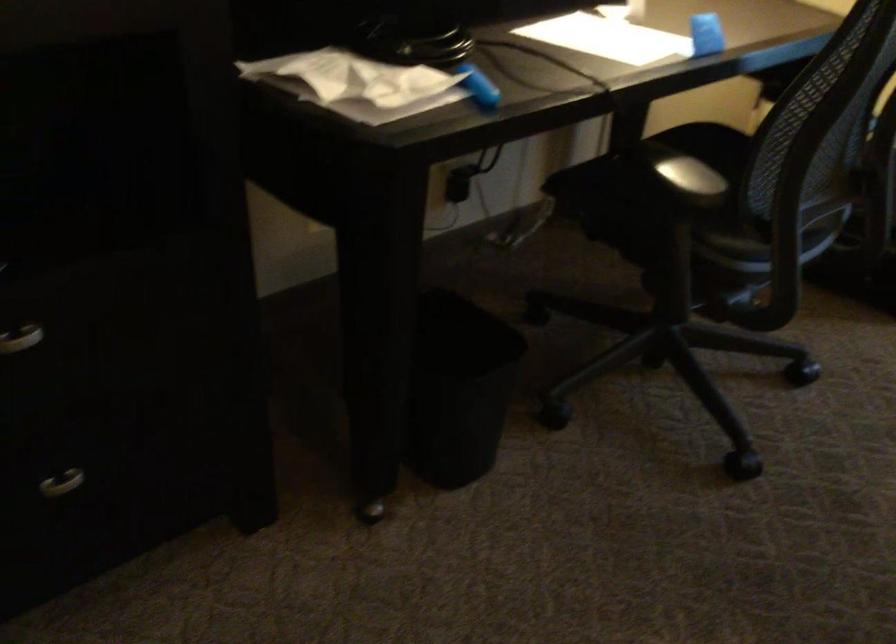
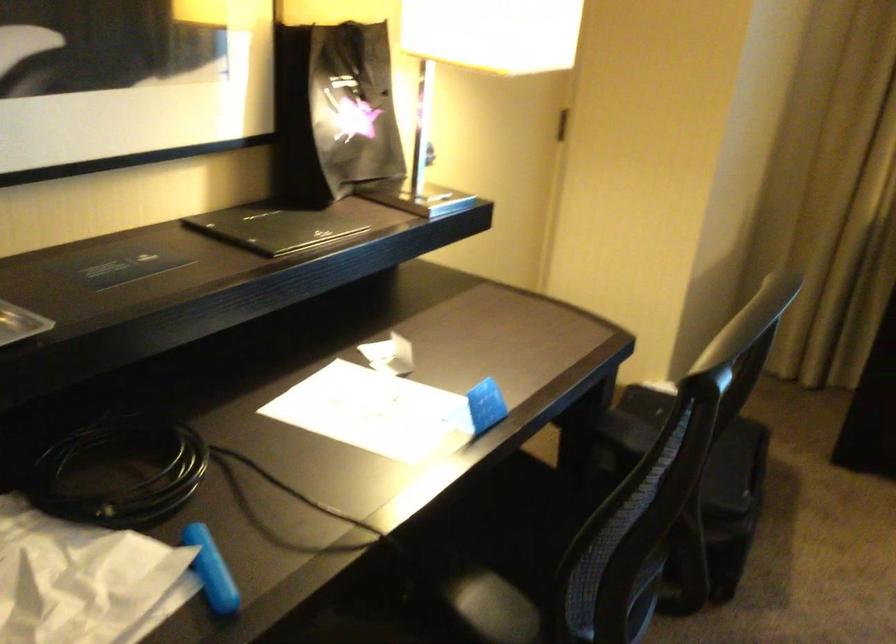
The point at (478, 79) is marked in the first image. Where is the corresponding point in the second image?

(211, 570)